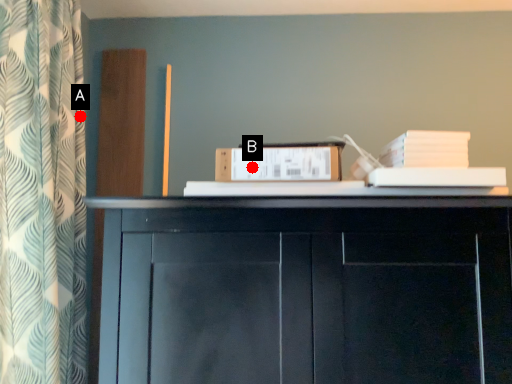
Question: Two points are circled on the image, labeled by A and B beside each circle. Which point appears closest to the camera in this image?

Choices:
 (A) A is closer
 (B) B is closer

Answer: (B)